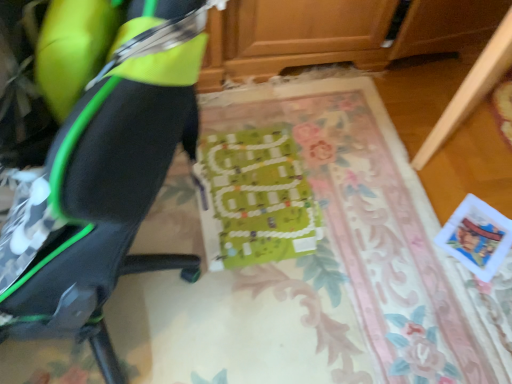
Question: Is wooden drawer at lower right next to matte black chair at left and touching it?

Choices:
 (A) yes
 (B) no

Answer: (B)

Question: From a real-world perspective, is wooden drawer at lower right on top of matte black chair at left?

Choices:
 (A) yes
 (B) no

Answer: (B)

Question: From a real-world perspective, is wooden drawer at lower right beneath matte black chair at left?

Choices:
 (A) no
 (B) yes

Answer: (B)

Question: Is wooden drawer at lower right to the right of matte black chair at left from the viewer's perspective?

Choices:
 (A) yes
 (B) no

Answer: (A)

Question: Is wooden drawer at lower right not within matte black chair at left?

Choices:
 (A) no
 (B) yes

Answer: (B)

Question: Is wooden drawer at lower right aimed at matte black chair at left?

Choices:
 (A) no
 (B) yes

Answer: (A)

Question: From the image's perspective, does matte black chair at left appear higher than green fabric board at center?

Choices:
 (A) no
 (B) yes

Answer: (B)

Question: Does matte black chair at left lie behind green fabric board at center?

Choices:
 (A) no
 (B) yes

Answer: (A)

Question: Can you confirm if matte black chair at left is positioned to the left of green fabric board at center?

Choices:
 (A) no
 (B) yes

Answer: (B)

Question: Considering the relative sizes of matte black chair at left and green fabric board at center in the image provided, is matte black chair at left thinner than green fabric board at center?

Choices:
 (A) no
 (B) yes

Answer: (B)

Question: From a real-world perspective, is matte black chair at left located higher than green fabric board at center?

Choices:
 (A) no
 (B) yes

Answer: (B)

Question: Could green fabric board at center be considered to be inside matte black chair at left?

Choices:
 (A) yes
 (B) no

Answer: (B)

Question: Does green fabric board at center have a greater width compared to wooden drawer at lower right?

Choices:
 (A) yes
 (B) no

Answer: (A)